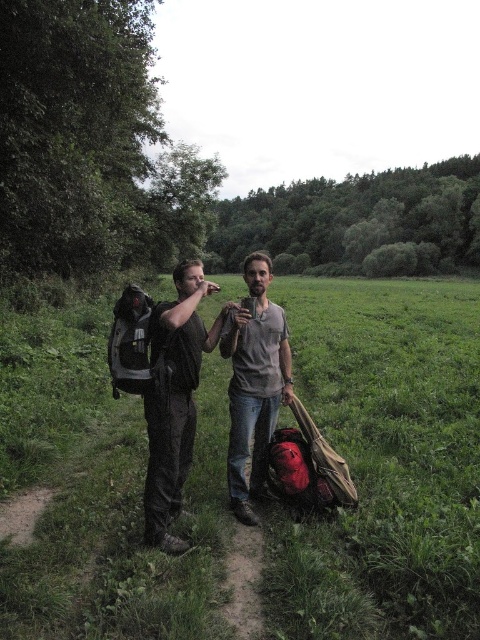
You are trying to locate the matte black backpack at left in the image. What are the coordinates of its position?

The coordinates of the matte black backpack at left are at point (384, 461).

You are trying to locate the matte black backpack at left and the matte gray shirt at center in the image. According to the scene description, which object is positioned more to the left side?

The matte gray shirt at center is positioned more to the left side because the matte black backpack at left is to the right of it.